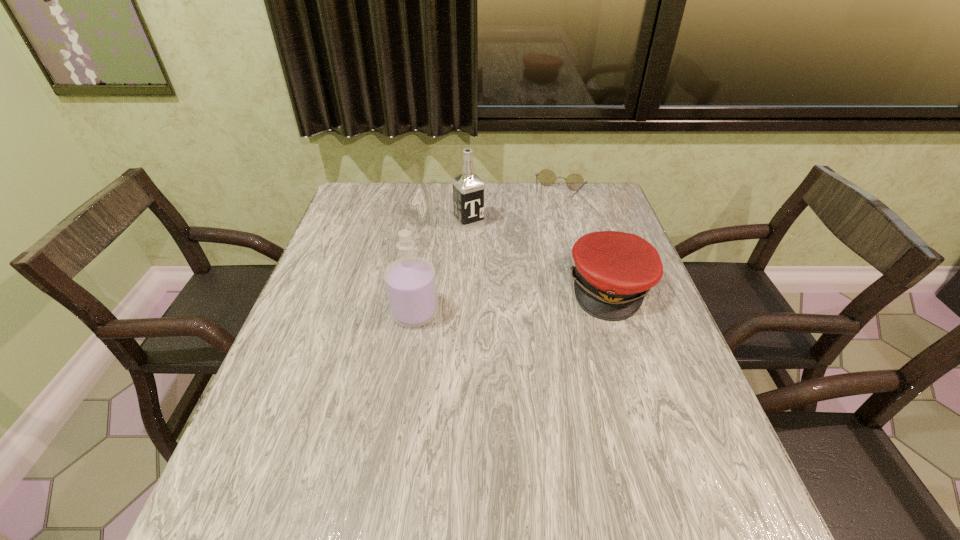
Find the location of a particular element. vacant space on the desktop that is between the perfume and the cap and is positioned on the front label of the third nearest object is located at coordinates (535, 298).

Where is `free space on the desktop that is between the perfume and the second shortest object and is positioned on the front-facing side of the shortest object`? free space on the desktop that is between the perfume and the second shortest object and is positioned on the front-facing side of the shortest object is located at coordinates (518, 299).